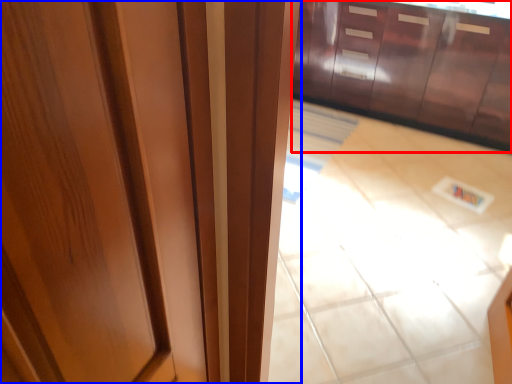
Question: Which object is closer to the camera taking this photo, cabinetry (highlighted by a red box) or door (highlighted by a blue box)?

Choices:
 (A) cabinetry
 (B) door

Answer: (B)